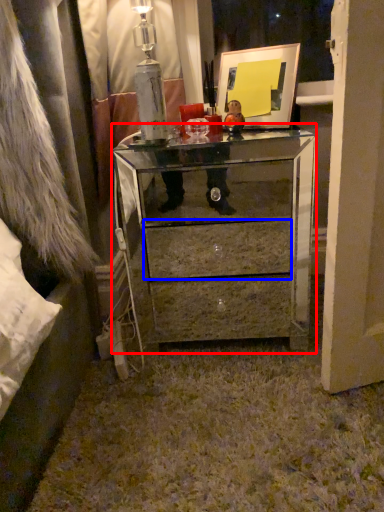
Question: Which point is closer to the camera, chest of drawers (highlighted by a red box) or drawer (highlighted by a blue box)?

Choices:
 (A) chest of drawers
 (B) drawer

Answer: (A)